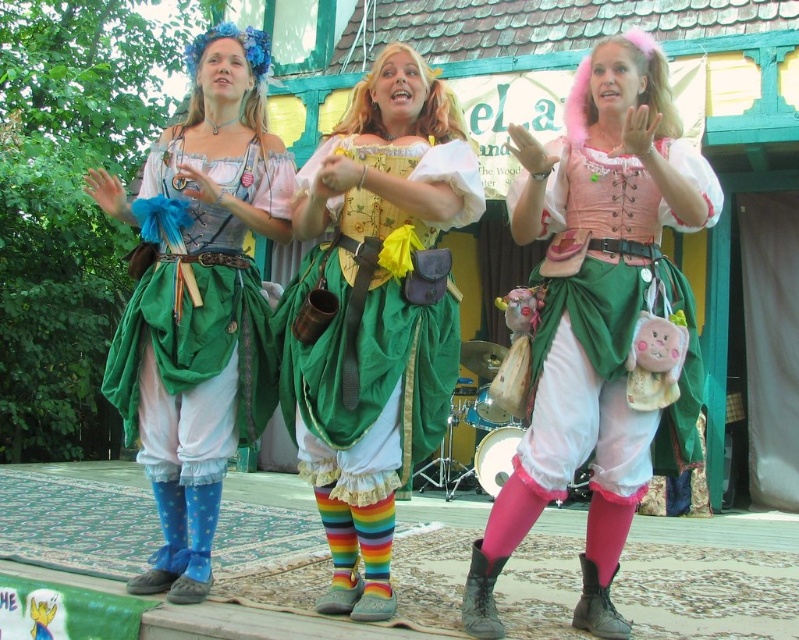
Based on the scene description, which object is shorter in height between the pink matte skirt at center and the matte blue fabric dress at left?

The pink matte skirt at center is shorter in height than the matte blue fabric dress at left.

You are a stagehand preparing to adjust the lighting for the performance. You need to position a spotlight on the pink matte skirt at center and the matte yellow corset at center. According to the description, which object is positioned to the right of the other?

The pink matte skirt at center is to the right of the matte yellow corset at center.

You are a stagehand responsible for placing a 7 meter long decorative banner between the pink matte skirt at center and the matte blue fabric dress at left. Can the banner fit between them without overlapping either costume?

The distance between the pink matte skirt at center and the matte blue fabric dress at left is 6.86 meters. Since the banner is 7 meters long, it would be slightly too long to fit between them without overlapping the costumes.